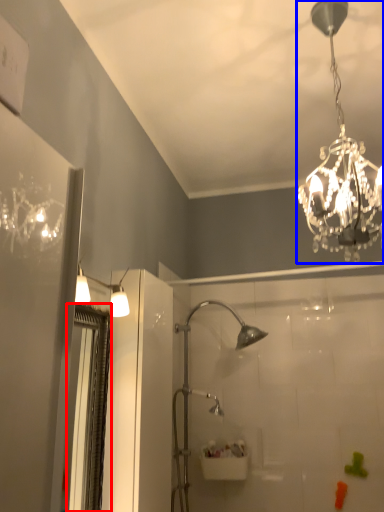
Question: Which object appears closest to the camera in this image, screen door (highlighted by a red box) or lamp (highlighted by a blue box)?

Choices:
 (A) screen door
 (B) lamp

Answer: (B)